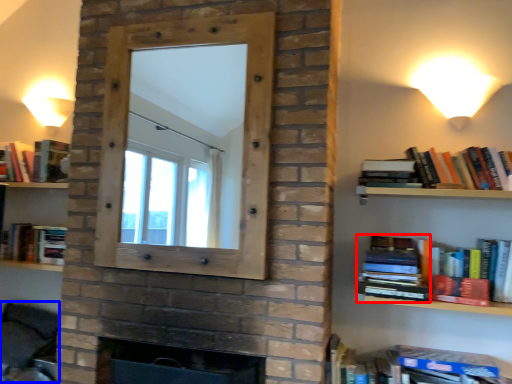
Question: Which object appears closest to the camera in this image, paperback book (highlighted by a red box) or swivel chair (highlighted by a blue box)?

Choices:
 (A) paperback book
 (B) swivel chair

Answer: (A)